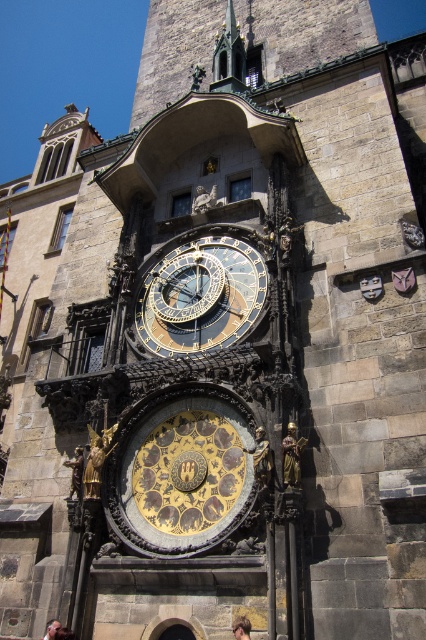
Is goldmetallicclock at center taller than golden hair at center?

Yes.

Which is above, goldmetallicclock at center or golden hair at center?

goldmetallicclock at center is above.

This screenshot has width=426, height=640. What do you see at coordinates (180, 472) in the screenshot? I see `goldmetallicclock at center` at bounding box center [180, 472].

Locate an element on the screen. goldmetallicclock at center is located at coordinates (180, 472).

I want to click on gold metallic clock at center, so click(x=201, y=296).

Can you confirm if gold metallic clock at center is thinner than light brown leather jacket at lower center?

No, gold metallic clock at center is not thinner than light brown leather jacket at lower center.

Is point (229, 317) less distant than point (54, 621)?

No, it is behind (54, 621).

The width and height of the screenshot is (426, 640). What are the coordinates of `gold metallic clock at center` in the screenshot? It's located at (201, 296).

What do you see at coordinates (241, 627) in the screenshot? This screenshot has height=640, width=426. I see `golden hair at center` at bounding box center [241, 627].

Does point (241, 630) come behind point (51, 628)?

That is False.

I want to click on golden hair at center, so click(x=241, y=627).